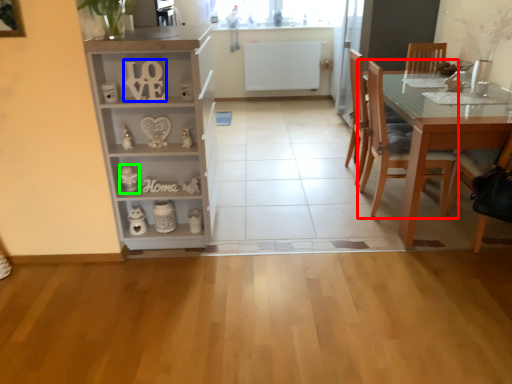
Question: Which object is positioned closest to chair (highlighted by a red box)? Select from number (highlighted by a blue box) and toy (highlighted by a green box).

Choices:
 (A) number
 (B) toy

Answer: (A)